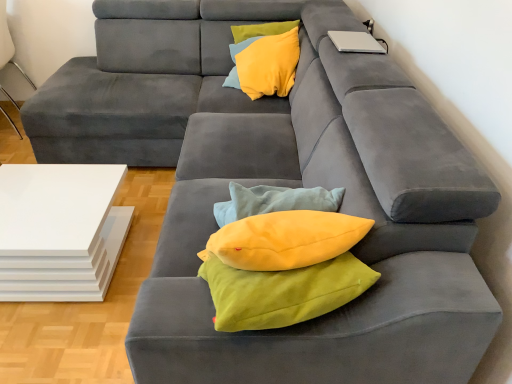
Question: In the image, is silver metallic laptop at upper right on the left side or the right side of white glossy side table at left?

Choices:
 (A) left
 (B) right

Answer: (B)

Question: From the image's perspective, is silver metallic laptop at upper right located above or below white glossy side table at left?

Choices:
 (A) below
 (B) above

Answer: (A)

Question: Which object is the farthest from the yellow soft cushion at upper center?

Choices:
 (A) silver metallic laptop at upper right
 (B) white glossy table at lower left
 (C) white glossy side table at left

Answer: (C)

Question: Estimate the real-world distances between objects in this image. Which object is closer to the silver metallic laptop at upper right?

Choices:
 (A) white glossy side table at left
 (B) white glossy table at lower left
 (C) yellow soft cushion at upper center

Answer: (C)